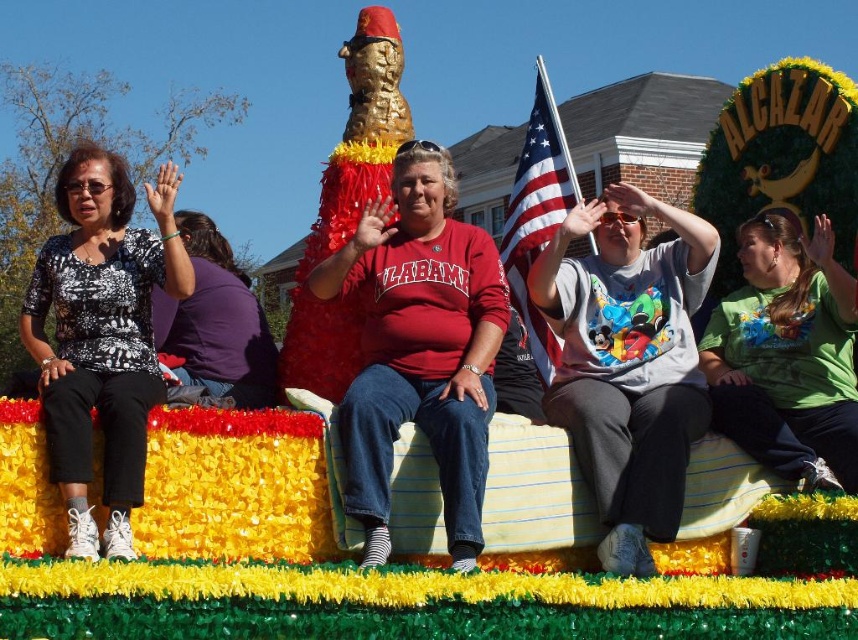
Question: Among these objects, which one is nearest to the camera?

Choices:
 (A) american flag at center
 (B) green matte shirt at center
 (C) matte red sweatshirt at center
 (D) printed fabric blouse at left

Answer: (D)

Question: Can you confirm if printed fabric blouse at left is positioned to the right of matte purple shirt at center?

Choices:
 (A) no
 (B) yes

Answer: (A)

Question: Which point is farther to the camera?

Choices:
 (A) pos(210,321)
 (B) pos(115,381)

Answer: (A)

Question: Is printed fabric blouse at left bigger than matte purple shirt at center?

Choices:
 (A) yes
 (B) no

Answer: (A)

Question: Which of these objects is positioned farthest from the matte red sweatshirt at center?

Choices:
 (A) american flag at center
 (B) matte purple shirt at center
 (C) printed fabric blouse at left

Answer: (A)

Question: Does green matte shirt at center appear on the left side of american flag at center?

Choices:
 (A) no
 (B) yes

Answer: (A)